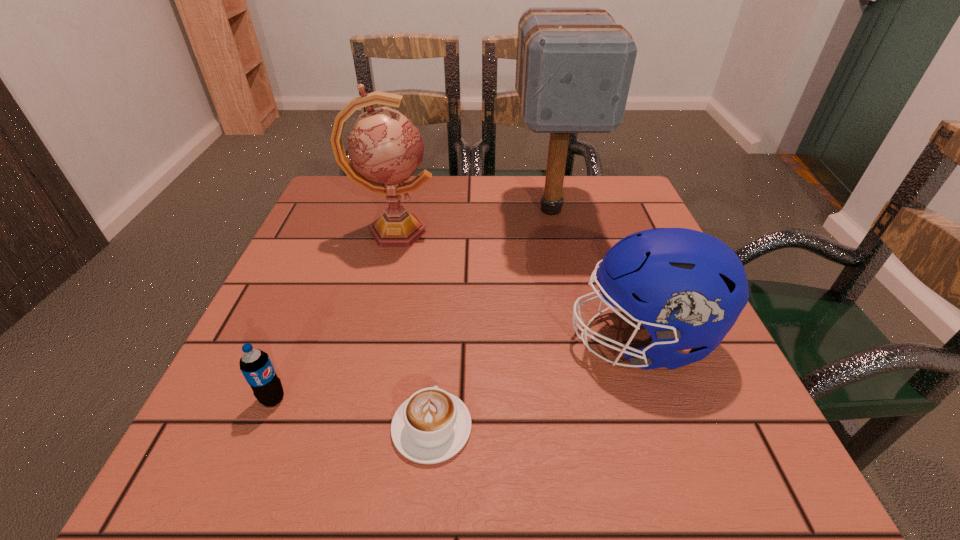
Where is `free space between the globe and the cappuccino`? This screenshot has height=540, width=960. free space between the globe and the cappuccino is located at coordinates (413, 329).

Where is `the third closest object to the shortest object`? the third closest object to the shortest object is located at coordinates (385, 148).

Identify which object is the second nearest to the second shortest object. Please provide its 2D coordinates. Your answer should be formatted as a tuple, i.e. [(x, y)], where the tuple contains the x and y coordinates of a point satisfying the conditions above.

[(385, 148)]

The image size is (960, 540). I want to click on vacant area in the image that satisfies the following two spatial constraints: 1. on the front-facing side of the second tallest object; 2. on the front side of the soda bottle, so click(351, 399).

You are a GUI agent. You are given a task and a screenshot of the screen. Output one action in this format:
    pyautogui.click(x=<x>, y=<y>)
    Task: Click on the vacant area that satisfies the following two spatial constraints: 1. on the front-facing side of the globe; 2. with the handle on the right side of the cappuccino
    This screenshot has width=960, height=540.
    Given the screenshot: What is the action you would take?
    pyautogui.click(x=345, y=427)

The width and height of the screenshot is (960, 540). I want to click on vacant position in the image that satisfies the following two spatial constraints: 1. with the handle on the right side of the shortest object; 2. on the front-facing side of the globe, so click(449, 232).

You are a GUI agent. You are given a task and a screenshot of the screen. Output one action in this format:
    pyautogui.click(x=<x>, y=<y>)
    Task: Click on the vacant region that satisfies the following two spatial constraints: 1. on the striking surface of the tallest object; 2. on the front-facing side of the fourth shortest object
    
    Given the screenshot: What is the action you would take?
    pyautogui.click(x=556, y=232)